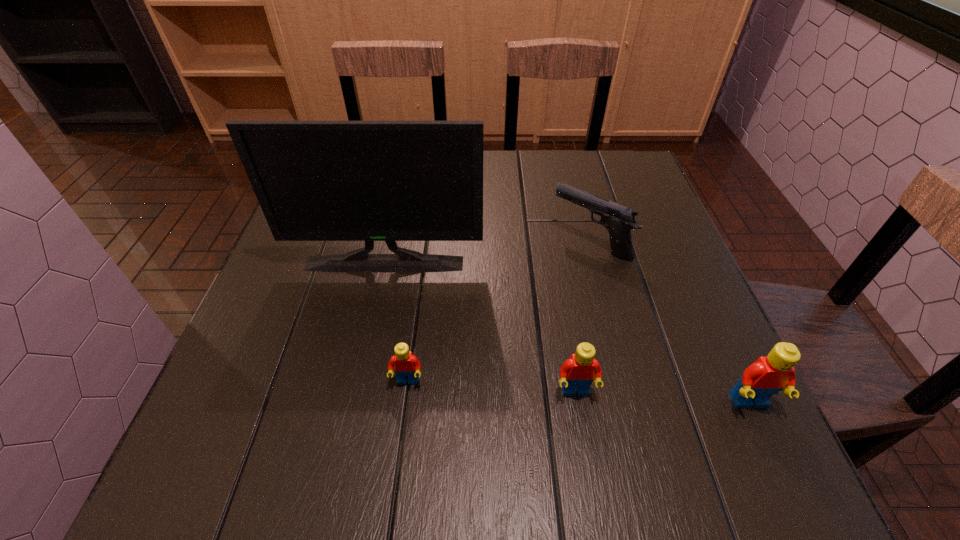
The width and height of the screenshot is (960, 540). Find the location of `empty location between the gun and the rightmost object`. empty location between the gun and the rightmost object is located at coordinates (670, 323).

Find the location of a particular element. The width and height of the screenshot is (960, 540). free space between the gun and the rightmost object is located at coordinates (670, 323).

In order to click on unoccupied position between the second shortest Lego and the gun in this screenshot , I will do coord(583,318).

At what (x,y) coordinates should I click in order to perform the action: click on free space between the leftmost Lego and the second tallest Lego. Please return your answer as a coordinate pair (x, y). Looking at the image, I should click on (492, 387).

Image resolution: width=960 pixels, height=540 pixels. Find the location of `vacant area that lies between the shortest object and the tallest object`. vacant area that lies between the shortest object and the tallest object is located at coordinates (396, 322).

This screenshot has height=540, width=960. I want to click on free space that is in between the second shortest Lego and the gun, so click(583, 318).

This screenshot has width=960, height=540. In order to click on free space between the second Lego from left to right and the rightmost Lego in this screenshot , I will do `click(662, 397)`.

At what (x,y) coordinates should I click in order to perform the action: click on vacant space that's between the gun and the second Lego from right to left. Please return your answer as a coordinate pair (x, y). Looking at the image, I should click on (583, 318).

This screenshot has width=960, height=540. I want to click on free space between the gun and the rightmost object, so [670, 323].

Identify the location of free area in between the second Lego from left to right and the shortest Lego. (492, 387).